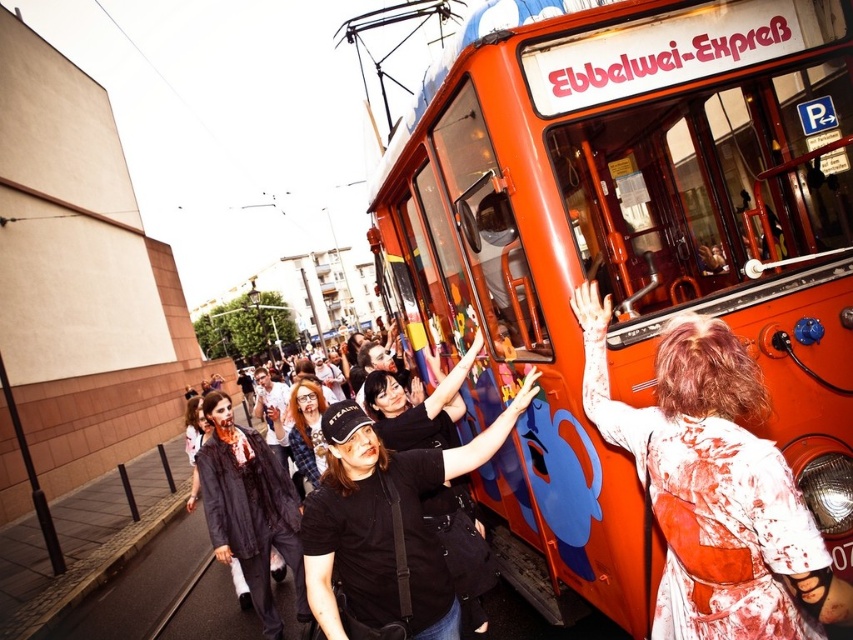
Does point (541, 140) come farther from viewer compared to point (296, 408)?

No, (541, 140) is closer to viewer.

Between point (604, 516) and point (291, 397), which one is positioned behind?

Point (291, 397)

Find the location of a particular element. The height and width of the screenshot is (640, 853). orange painted metal tram at center is located at coordinates (625, 248).